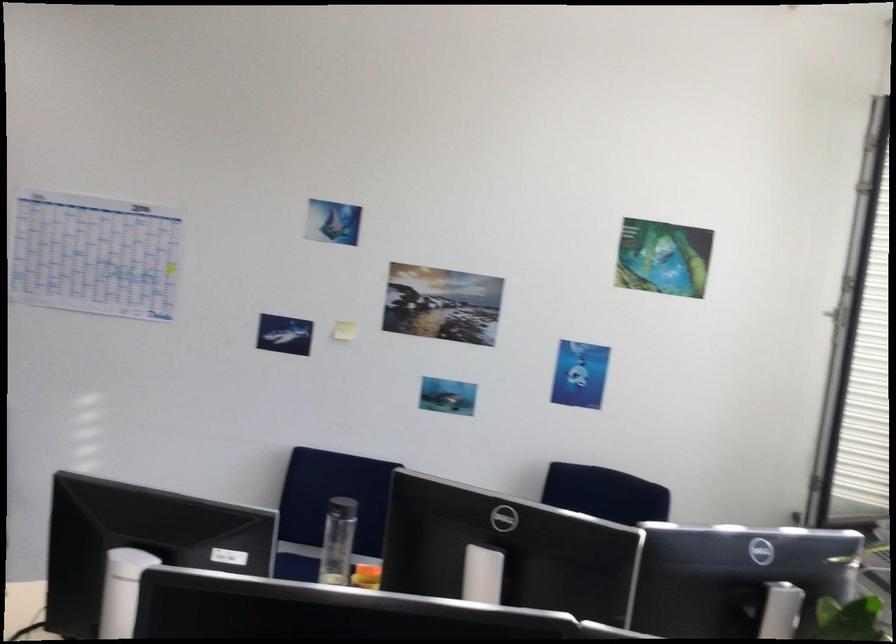
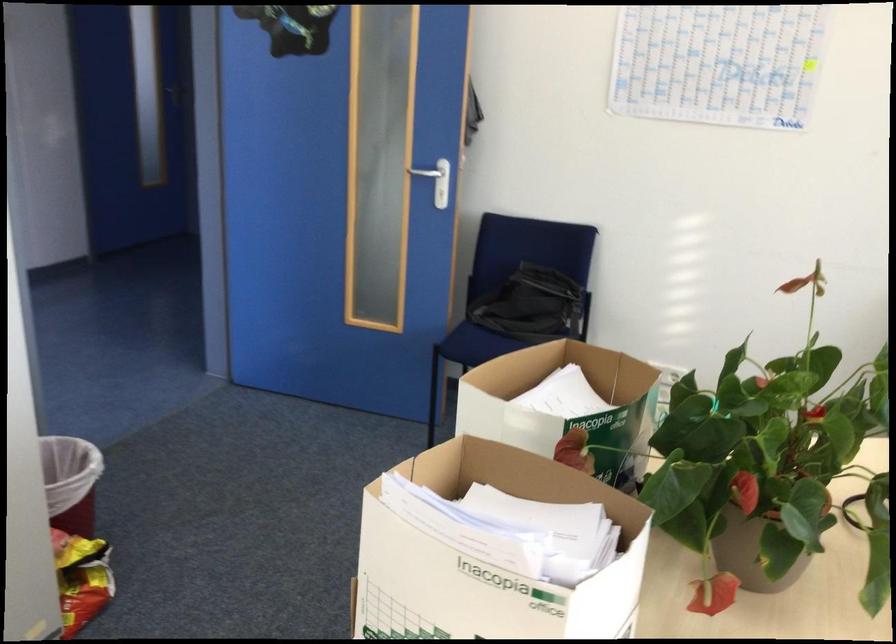
The images are taken continuously from a first-person perspective. In which direction is your viewpoint rotating?

The camera's rotation is toward left-down.